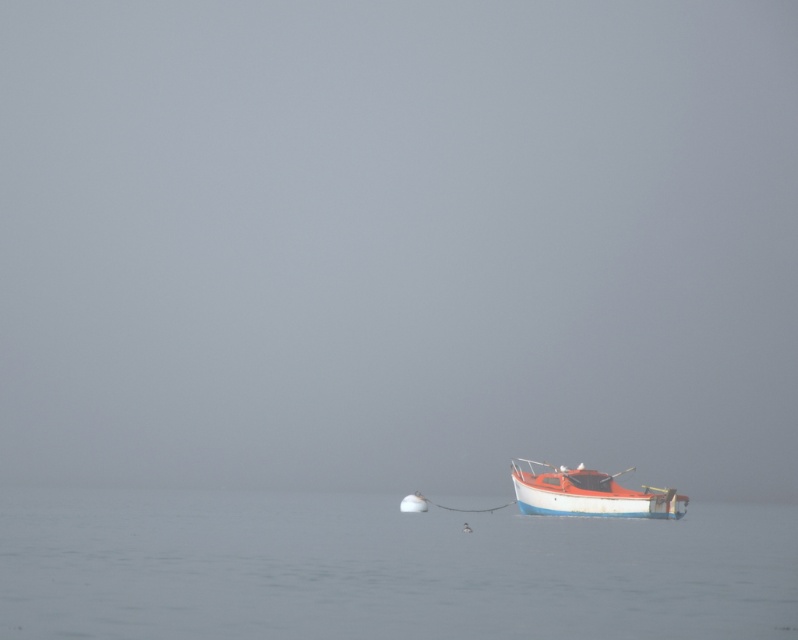
Question: Is matte white boat at lower right bigger than white matte buoy at center?

Choices:
 (A) yes
 (B) no

Answer: (B)

Question: Which point is closer to the camera?

Choices:
 (A) (421, 502)
 (B) (523, 561)

Answer: (B)

Question: Is smooth water at boat right bigger than white matte buoy at center?

Choices:
 (A) no
 (B) yes

Answer: (B)

Question: Which of the following is the closest to the observer?

Choices:
 (A) matte white boat at lower right
 (B) smooth water at boat right
 (C) white matte buoy at center

Answer: (B)

Question: Is smooth water at boat right above matte white boat at lower right?

Choices:
 (A) no
 (B) yes

Answer: (A)

Question: Among these objects, which one is nearest to the camera?

Choices:
 (A) white matte buoy at center
 (B) matte white boat at lower right
 (C) smooth water at boat right

Answer: (C)